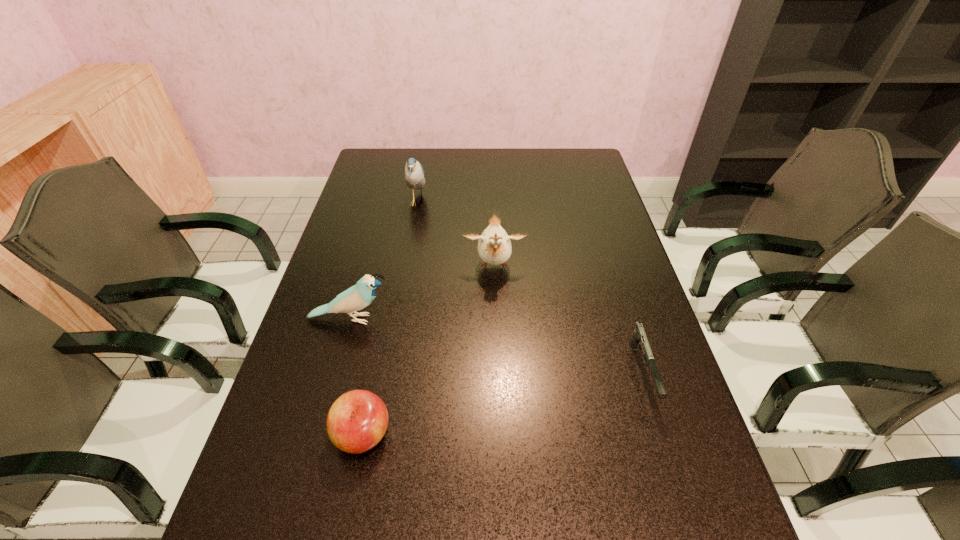
At what (x,y) coordinates should I click in order to perform the action: click on the farthest bird. Please return your answer as a coordinate pair (x, y). Looking at the image, I should click on (414, 173).

Locate an element on the screen. This screenshot has width=960, height=540. the second farthest object is located at coordinates (494, 246).

Find the location of a particular element. the rightmost bird is located at coordinates (494, 246).

Locate an element on the screen. The width and height of the screenshot is (960, 540). the nearest bird is located at coordinates (357, 297).

You are a GUI agent. You are given a task and a screenshot of the screen. Output one action in this format:
    pyautogui.click(x=<x>, y=<y>)
    Task: Click on the second shortest object
    This screenshot has width=960, height=540.
    Given the screenshot: What is the action you would take?
    pyautogui.click(x=357, y=421)

Where is `the rightmost object`? The height and width of the screenshot is (540, 960). the rightmost object is located at coordinates (639, 338).

The width and height of the screenshot is (960, 540). I want to click on gun, so click(x=639, y=338).

Locate an element on the screen. The width and height of the screenshot is (960, 540). vacant region located 0.300m at the tip of the farthest object's beak is located at coordinates pyautogui.click(x=516, y=202).

You are a GUI agent. You are given a task and a screenshot of the screen. Output one action in this format:
    pyautogui.click(x=<x>, y=<y>)
    Task: Click on the vacant space located at the beak of the fourth nearest object
    
    Given the screenshot: What is the action you would take?
    pyautogui.click(x=497, y=367)

At what (x,y) coordinates should I click in order to perform the action: click on vacant area located at the face of the third nearest object. Please return your answer as a coordinate pair (x, y). This screenshot has width=960, height=540. Looking at the image, I should click on (432, 319).